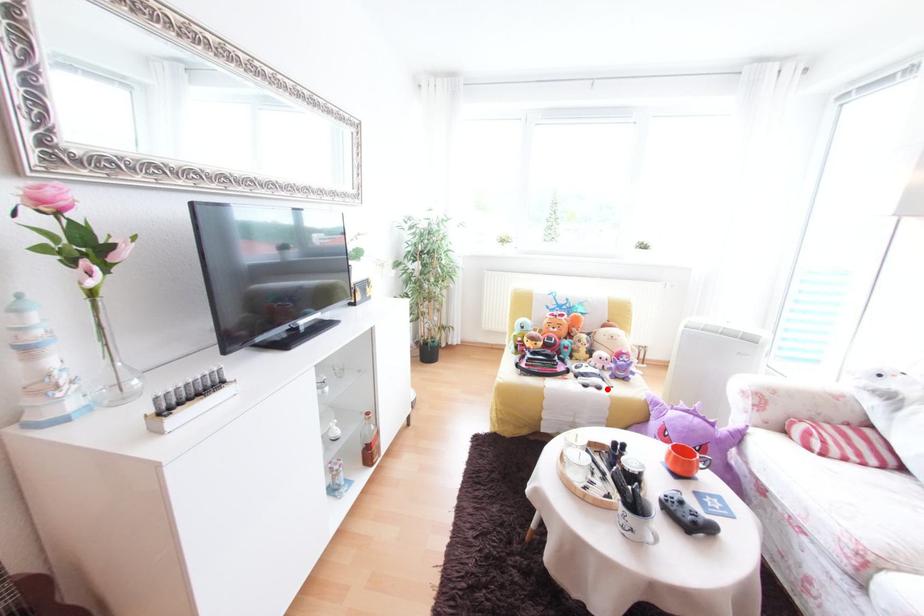
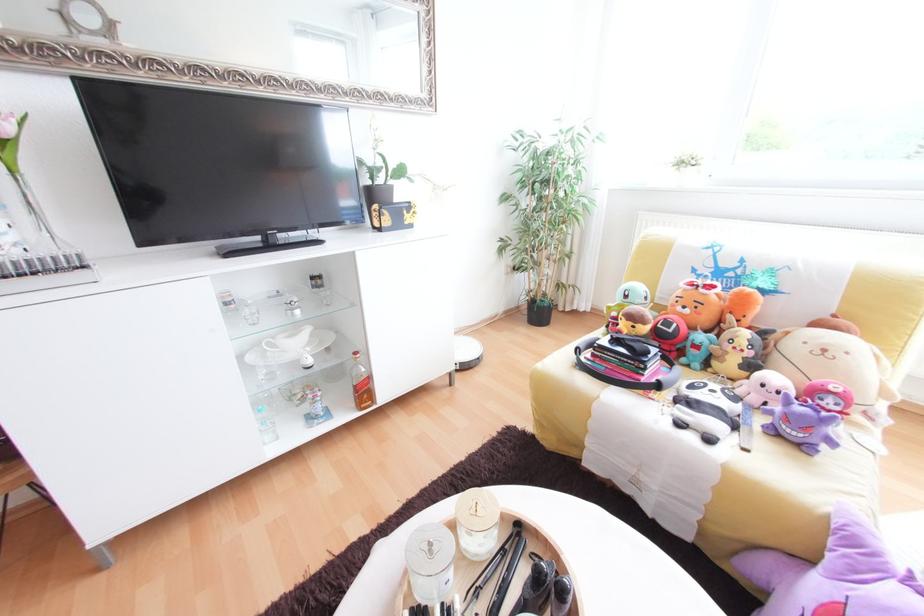
The point at the highlighted location is marked in the first image. Where is the corresponding point in the second image?

(718, 440)